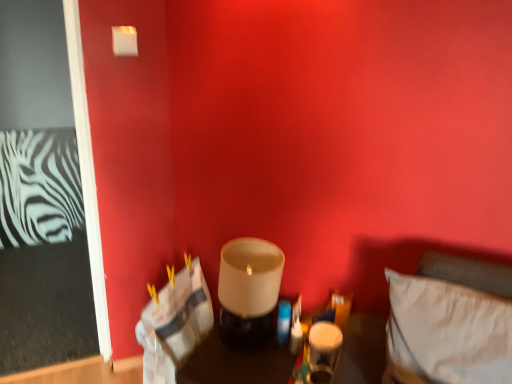
Where is `free space above translucent glass candle holder at center (from a real-world perspective)`? The width and height of the screenshot is (512, 384). free space above translucent glass candle holder at center (from a real-world perspective) is located at coordinates (259, 362).